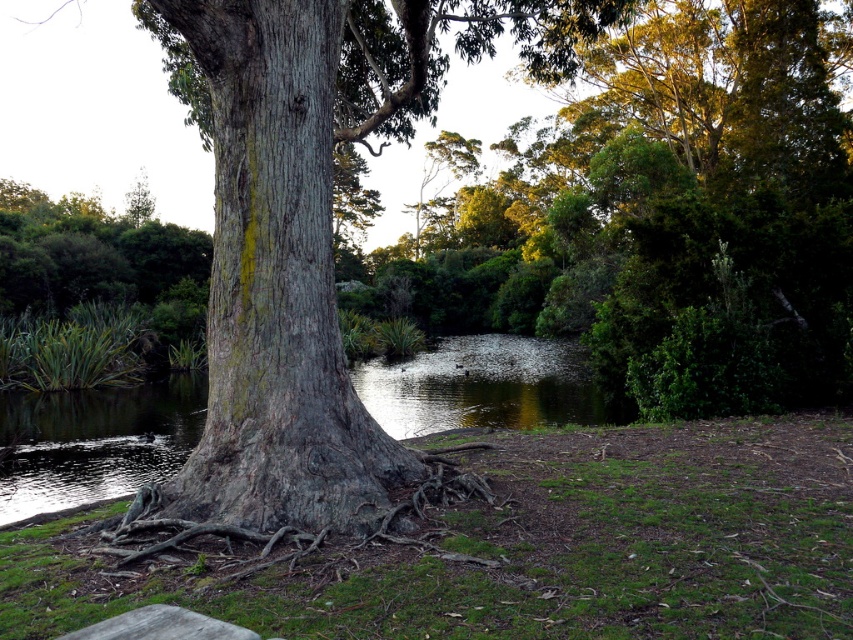
Question: Which point is closer to the camera?

Choices:
 (A) (207, 310)
 (B) (247, 630)

Answer: (B)

Question: Which object is positioned farthest from the gray rough bark tree trunk at center?

Choices:
 (A) smooth gray stone bench at lower left
 (B) greenish reflective water at center

Answer: (B)

Question: Does gray rough bark tree trunk at center have a smaller size compared to smooth gray stone bench at lower left?

Choices:
 (A) yes
 (B) no

Answer: (B)

Question: Is gray rough bark tree trunk at center to the right of smooth gray stone bench at lower left from the viewer's perspective?

Choices:
 (A) yes
 (B) no

Answer: (B)

Question: Is greenish reflective water at center to the left of smooth gray stone bench at lower left from the viewer's perspective?

Choices:
 (A) no
 (B) yes

Answer: (B)

Question: Based on their relative distances, which object is farther from the greenish reflective water at center?

Choices:
 (A) smooth gray stone bench at lower left
 (B) gray rough bark tree trunk at center

Answer: (A)